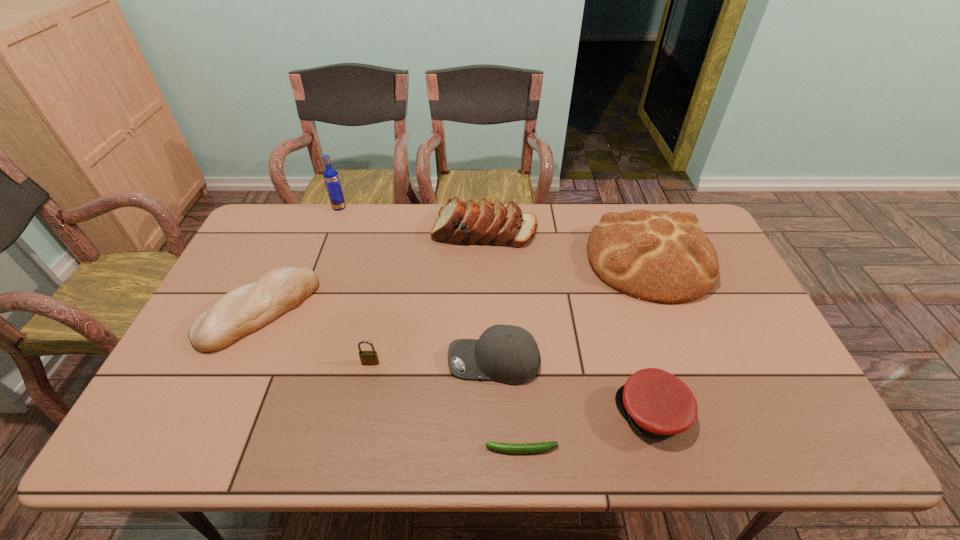
The width and height of the screenshot is (960, 540). In order to click on free spot between the seventh shortest object and the baseball cap in this screenshot , I will do `click(571, 310)`.

Find the location of a particular element. The image size is (960, 540). free space between the baseball cap and the farthest object is located at coordinates (417, 285).

Locate an element on the screen. vacant space that's between the second bread from right to left and the tallest bread is located at coordinates (566, 245).

Find the location of a particular element. This screenshot has width=960, height=540. vacant area that lies between the second bread from left to right and the seventh shortest object is located at coordinates (566, 245).

Choose which object is the third nearest neighbor to the tallest object. Please provide its 2D coordinates. Your answer should be formatted as a tuple, i.e. [(x, y)], where the tuple contains the x and y coordinates of a point satisfying the conditions above.

[(367, 357)]

This screenshot has height=540, width=960. What are the coordinates of `the fifth closest object to the cap` in the screenshot? It's located at (367, 357).

Identify which bread is the third closest to the zucchini. Please provide its 2D coordinates. Your answer should be formatted as a tuple, i.e. [(x, y)], where the tuple contains the x and y coordinates of a point satisfying the conditions above.

[(458, 222)]

Find the location of `bread that can be found as the second closest to the second shortest bread`. bread that can be found as the second closest to the second shortest bread is located at coordinates (247, 308).